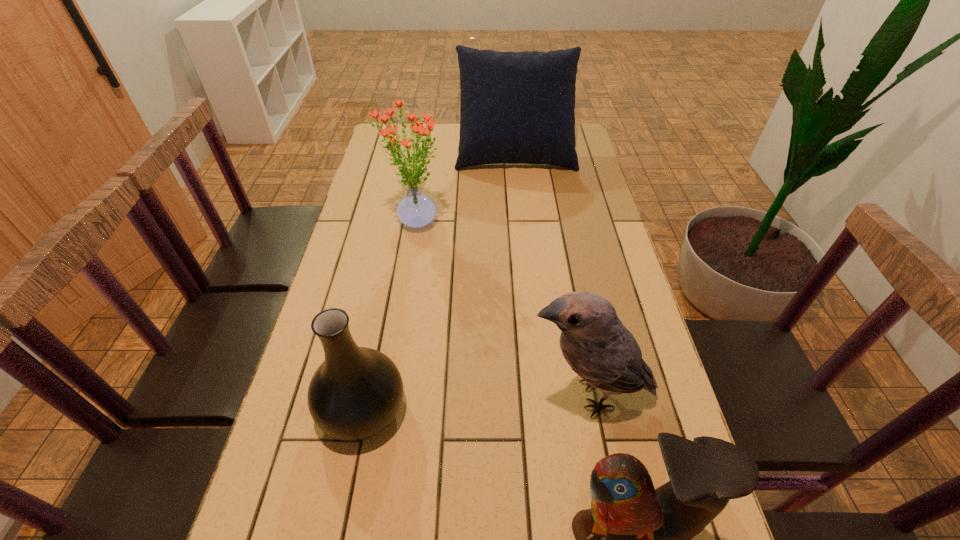
You are a GUI agent. You are given a task and a screenshot of the screen. Output one action in this format:
    pyautogui.click(x=<x>, y=<y>)
    Task: Click on the second farthest object
    The width and height of the screenshot is (960, 540).
    Given the screenshot: What is the action you would take?
    pyautogui.click(x=416, y=210)

The image size is (960, 540). I want to click on the farthest object, so click(515, 107).

The height and width of the screenshot is (540, 960). Identify the location of the farther parrot. (594, 342).

Image resolution: width=960 pixels, height=540 pixels. Find the location of `vase`. vase is located at coordinates (356, 392).

This screenshot has height=540, width=960. I want to click on free space located 0.400m on the front of the second farthest object, so click(x=393, y=356).

The height and width of the screenshot is (540, 960). I want to click on vacant space located on the facing side of the cushion, so click(x=523, y=230).

What are the coordinates of `vacant space situated 0.390m on the front-facing side of the farther parrot` in the screenshot? It's located at (350, 394).

This screenshot has width=960, height=540. What are the coordinates of `free space located 0.300m on the front-facing side of the farther parrot` in the screenshot? It's located at (391, 394).

Locate an element on the screen. Image resolution: width=960 pixels, height=540 pixels. vacant space located 0.150m on the front-facing side of the farther parrot is located at coordinates (458, 394).

Identify the location of vacant space located on the back of the vase. The image size is (960, 540). (373, 352).